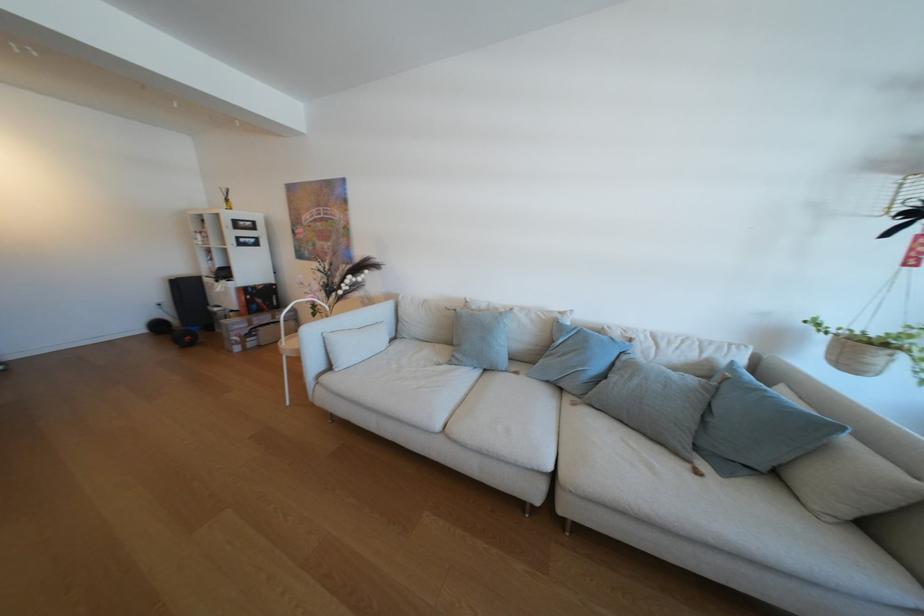
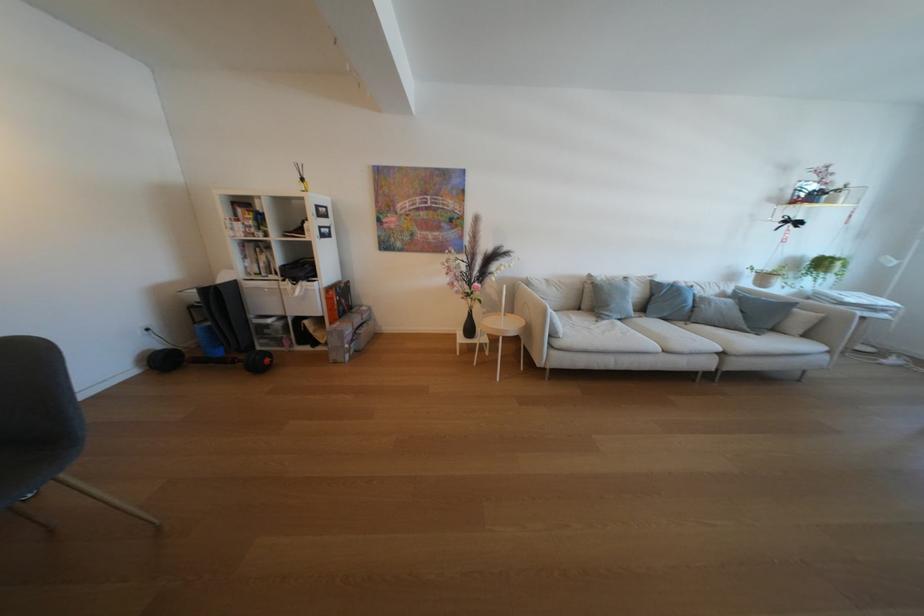
In the second image, find the point that corresponds to the point at 213,243 in the first image.

(256, 233)